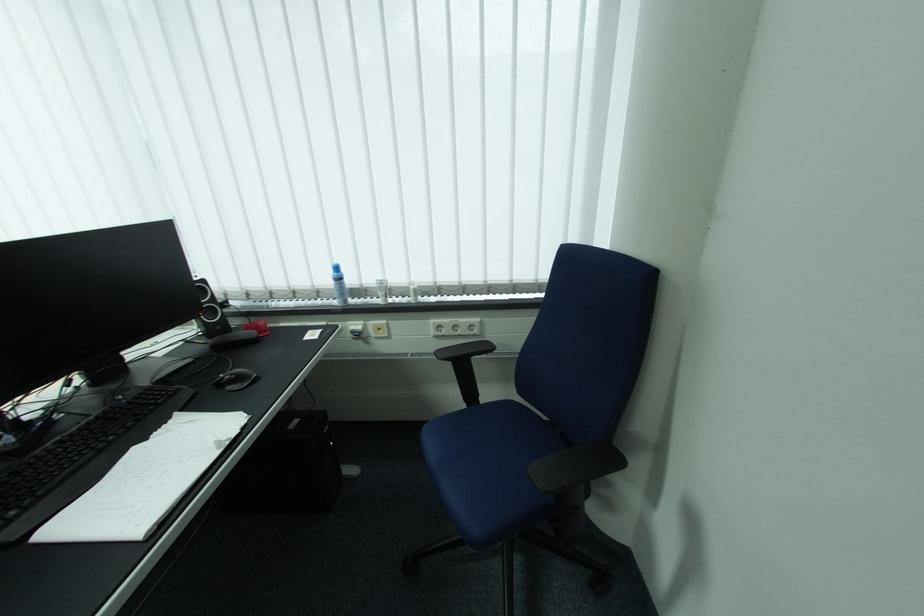
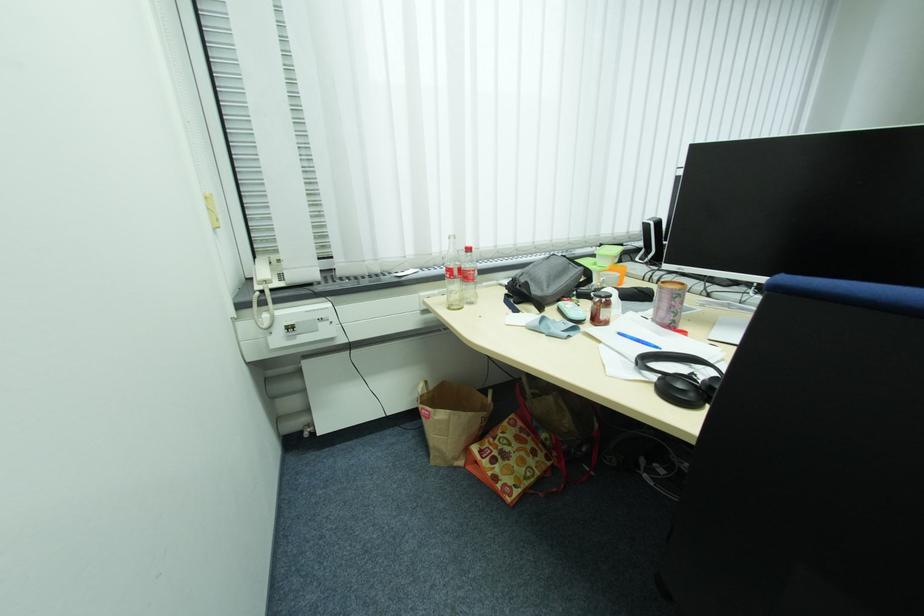
Question: What movement of the cameraman would produce the second image?

Choices:
 (A) Left
 (B) Right
 (C) Forward
 (D) Backward

Answer: (A)